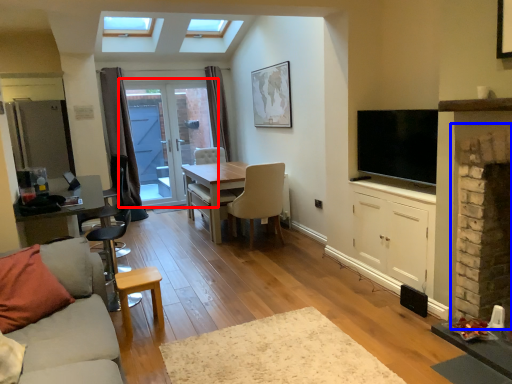
Question: Which of the following is the farthest to the observer, door (highlighted by a red box) or fireplace (highlighted by a blue box)?

Choices:
 (A) door
 (B) fireplace

Answer: (A)